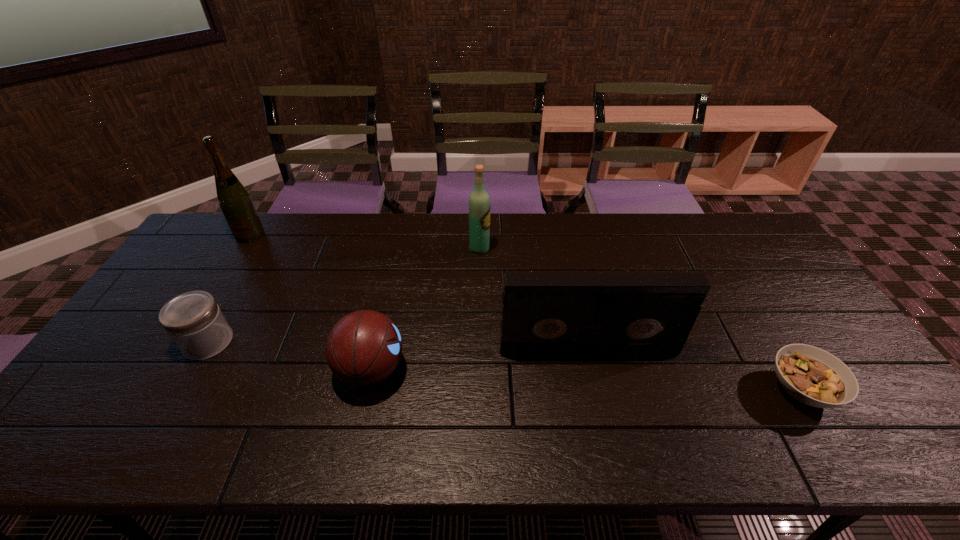
I want to click on object that is at the near right corner, so click(x=813, y=376).

At what (x,y) coordinates should I click in order to perform the action: click on vacant space at the far edge of the desktop. Please return your answer as a coordinate pair (x, y). This screenshot has height=540, width=960. Looking at the image, I should click on (693, 247).

Identify the location of vacant space at the near edge of the desktop. (180, 441).

In the image, there is a desktop. Where is `vacant area at the left edge`? This screenshot has width=960, height=540. vacant area at the left edge is located at coordinates (180, 274).

In the image, there is a desktop. Identify the location of free space at the near left corner. This screenshot has height=540, width=960. (71, 430).

This screenshot has height=540, width=960. In the image, there is a desktop. What are the coordinates of `free space at the far right corner` in the screenshot? It's located at (724, 218).

This screenshot has width=960, height=540. I want to click on free point between the videotape and the stew, so click(694, 369).

I want to click on free space between the second shortest object and the right wine bottle, so click(344, 295).

The image size is (960, 540). In order to click on free spot between the third tallest object and the stew in this screenshot , I will do `click(694, 369)`.

You are a GUI agent. You are given a task and a screenshot of the screen. Output one action in this format:
    pyautogui.click(x=<x>, y=<y>)
    Task: Click on the free spot between the left wine bottle and the fourth shortest object
    
    Given the screenshot: What is the action you would take?
    pyautogui.click(x=419, y=292)